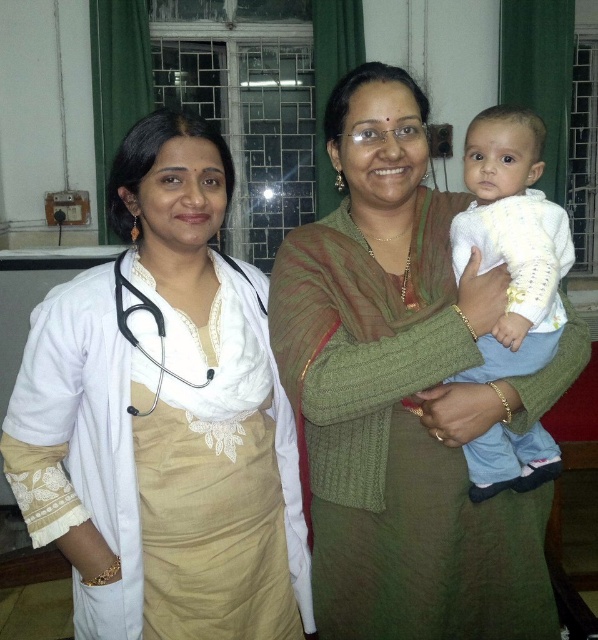
Question: Among these objects, which one is nearest to the camera?

Choices:
 (A) white lace dress at left
 (B) green knitted sweater at center

Answer: (B)

Question: Where is white lace dress at left located in relation to white soft fabric baby at center in the image?

Choices:
 (A) above
 (B) below

Answer: (B)

Question: Among these objects, which one is farthest from the camera?

Choices:
 (A) white soft fabric baby at center
 (B) green knitted sweater at center

Answer: (A)

Question: Considering the relative positions of green knitted sweater at center and white matte stethoscope at left in the image provided, where is green knitted sweater at center located with respect to white matte stethoscope at left?

Choices:
 (A) right
 (B) left

Answer: (A)

Question: Is white lace dress at left above green knitted sweater at center?

Choices:
 (A) no
 (B) yes

Answer: (A)

Question: Which point is closer to the camera?

Choices:
 (A) (219, 611)
 (B) (501, 154)
 (C) (251, 288)

Answer: (B)